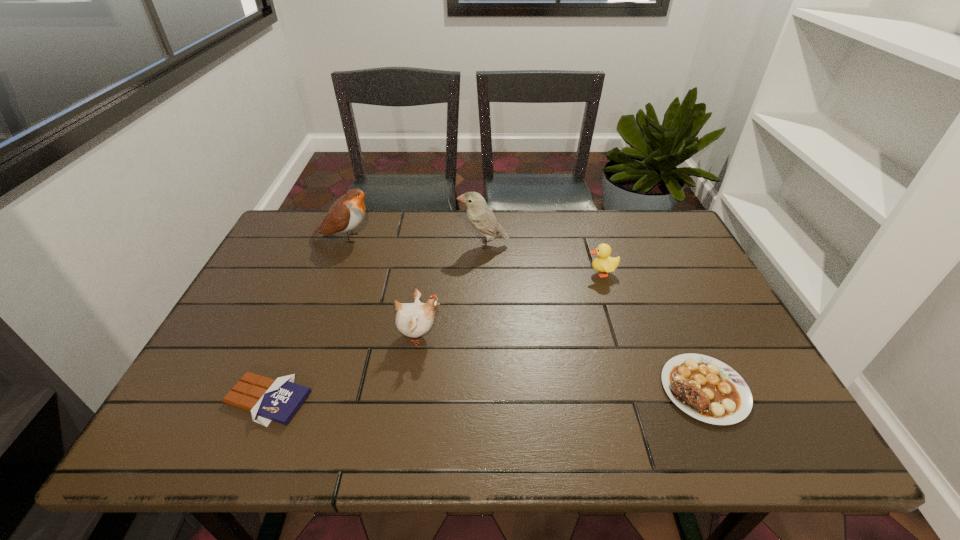
I want to click on vacant space at the right edge, so click(695, 286).

In the image, there is a desktop. Identify the location of free space at the far left corner. (301, 210).

Locate an element on the screen. Image resolution: width=960 pixels, height=540 pixels. vacant position at the near left corner of the desktop is located at coordinates (204, 446).

The height and width of the screenshot is (540, 960). In the image, there is a desktop. Find the location of `vacant space at the far right corner`. vacant space at the far right corner is located at coordinates (626, 222).

Locate an element on the screen. This screenshot has width=960, height=540. blank region between the third object from right to left and the chocolate bar is located at coordinates (375, 322).

This screenshot has height=540, width=960. In order to click on free space that is in between the shortest object and the duckling in this screenshot , I will do `click(435, 336)`.

Locate an element on the screen. The width and height of the screenshot is (960, 540). free point between the leftmost bird and the fourth object from left to right is located at coordinates (414, 241).

In order to click on free spot between the leftmost bird and the second bird from right to left in this screenshot , I will do `click(382, 287)`.

This screenshot has width=960, height=540. I want to click on free spot between the rightmost object and the fourth nearest object, so click(x=653, y=331).

Locate an element on the screen. Image resolution: width=960 pixels, height=540 pixels. empty space between the third object from right to left and the fourth object from right to left is located at coordinates (451, 290).